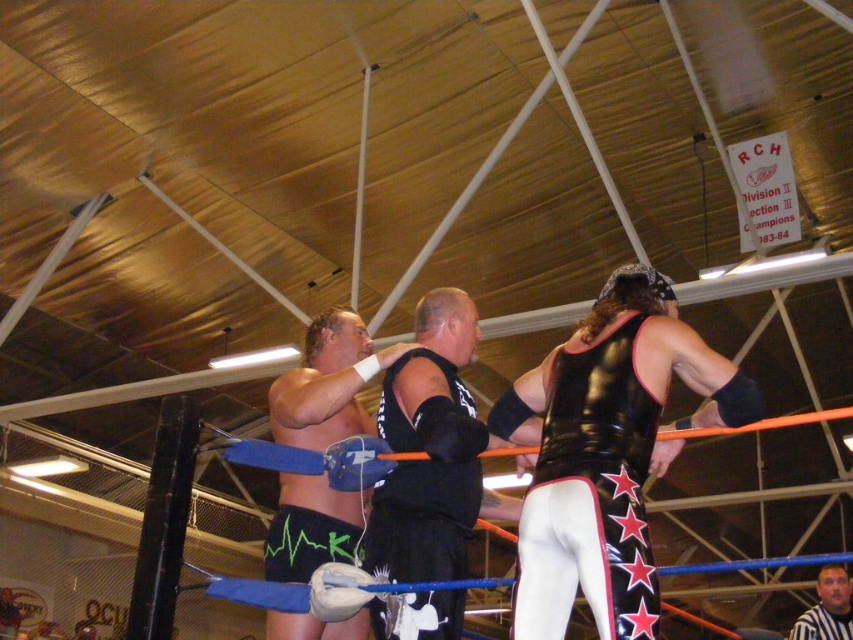
You are a photographer positioned at the back of the arena. You want to take a photo of the black matte vest at center and the black matte shorts at center. Which object will appear closer to you in the photo?

The black matte vest at center is in front of the black matte shorts at center, so it will appear closer to you in the photo.

Based on the photo, what are the coordinates of the black matte vest at center?

The coordinates of the black matte vest at center are at point [432,451].